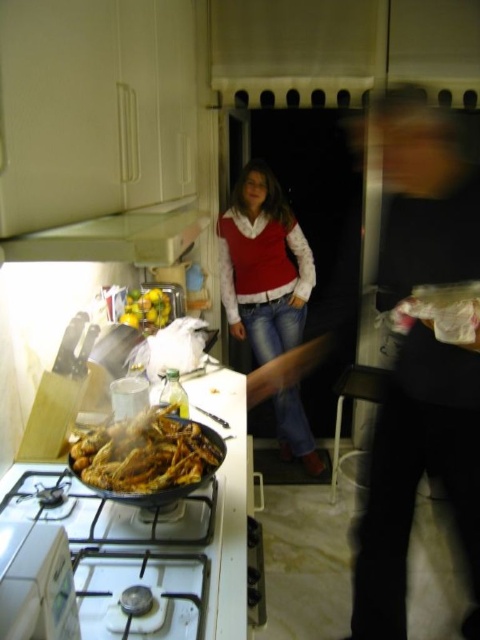
You are a chef in a busy kitchen. You need to quickly move from your current position near the smooth black shirt at right to reach the white matte exhaust hood at upper left to adjust its fan speed. Given that you can move at a speed of 1 meter per second, how many seconds will it take you to reach the exhaust hood?

The smooth black shirt at right is 29.76 inches from the white matte exhaust hood at upper left. Converting inches to meters, 29.76 inches is approximately 0.756 meters. At a speed of 1 meter per second, it would take roughly 0.756 seconds to reach the white matte exhaust hood at upper left.

Looking at this image, you are a chef preparing a dish and need to place the golden crispy chicken at center onto the white glossy gas stove at lower left. Can you fit the chicken on the stove without overlapping the edges?

The white glossy gas stove at lower left is wider than the golden crispy chicken at center, so yes, the chicken can be placed on the stove without overlapping the edges.

You are a chef wearing a smooth black shirt at right. You need to reach the white kettle on the stove to pour hot water. Can you estimate whether you can comfortably reach the kettle without moving your position?

The smooth black shirt at right is 4.22 feet away from the camera, so the chef can comfortably reach the kettle on the stove without moving since the distance is within a typical arm length.